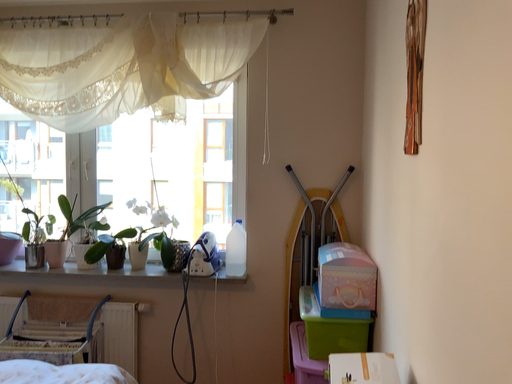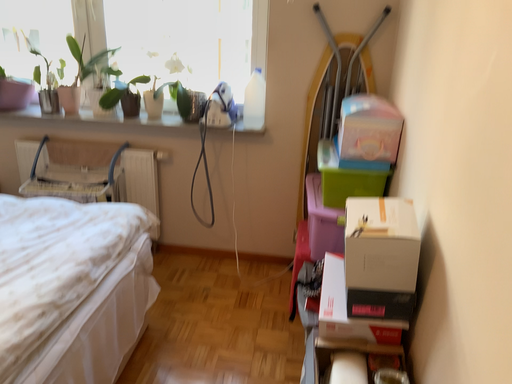
Question: How did the camera likely rotate when shooting the video?

Choices:
 (A) rotated upward
 (B) rotated downward

Answer: (B)